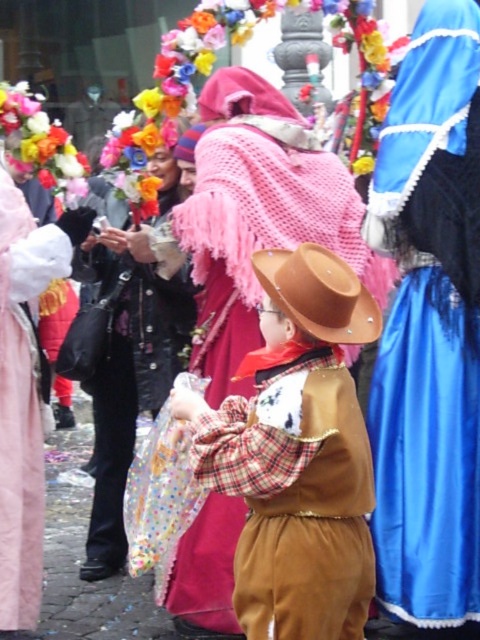
Does point (145, 376) come closer to viewer compared to point (66, 177)?

Yes, point (145, 376) is closer to viewer.

Does black leather jacket at left appear over fluffy fabric flowers at upper left?

No, black leather jacket at left is not above fluffy fabric flowers at upper left.

Who is more forward, [101,163] or [57,188]?

Positioned in front is point [101,163].

The image size is (480, 640). In order to click on black leather jacket at left in this screenshot , I will do `click(127, 374)`.

Can you confirm if black leather jacket at left is smaller than brown leather cowboy hat at center?

No, black leather jacket at left is not smaller than brown leather cowboy hat at center.

Can you confirm if black leather jacket at left is wider than brown leather cowboy hat at center?

Correct, the width of black leather jacket at left exceeds that of brown leather cowboy hat at center.

Does point (128, 291) come closer to viewer compared to point (322, 332)?

No, it is not.

Find the location of `black leather jacket at left`. black leather jacket at left is located at coordinates (127, 374).

Find the location of a particular element. Image resolution: width=480 pixels, height=640 pixels. blue satin dress at center is located at coordinates (430, 326).

What do you see at coordinates (430, 326) in the screenshot? I see `blue satin dress at center` at bounding box center [430, 326].

You are a GUI agent. You are given a task and a screenshot of the screen. Output one action in this format:
    pyautogui.click(x=<x>, y=<y>)
    Task: Click on the blue satin dress at center
    
    Given the screenshot: What is the action you would take?
    pyautogui.click(x=430, y=326)